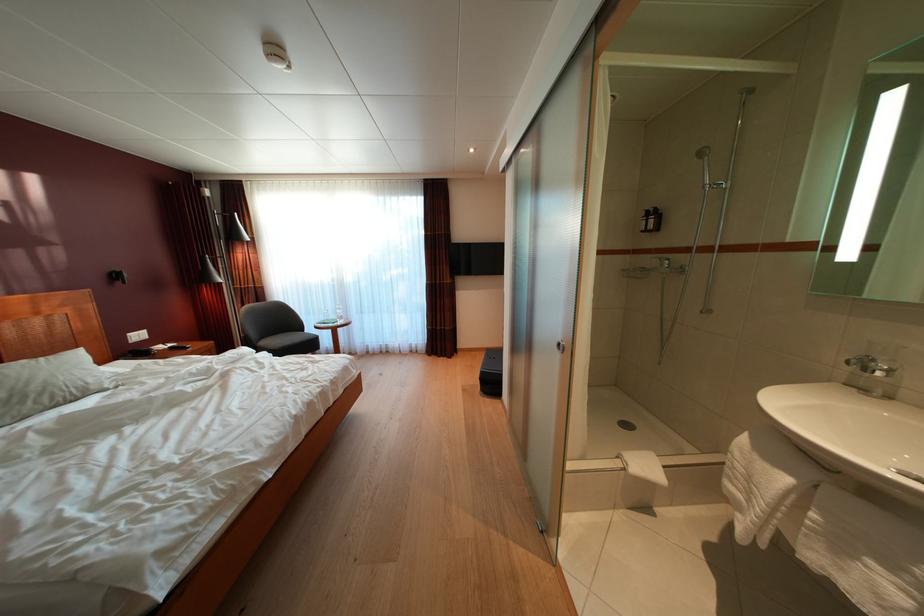
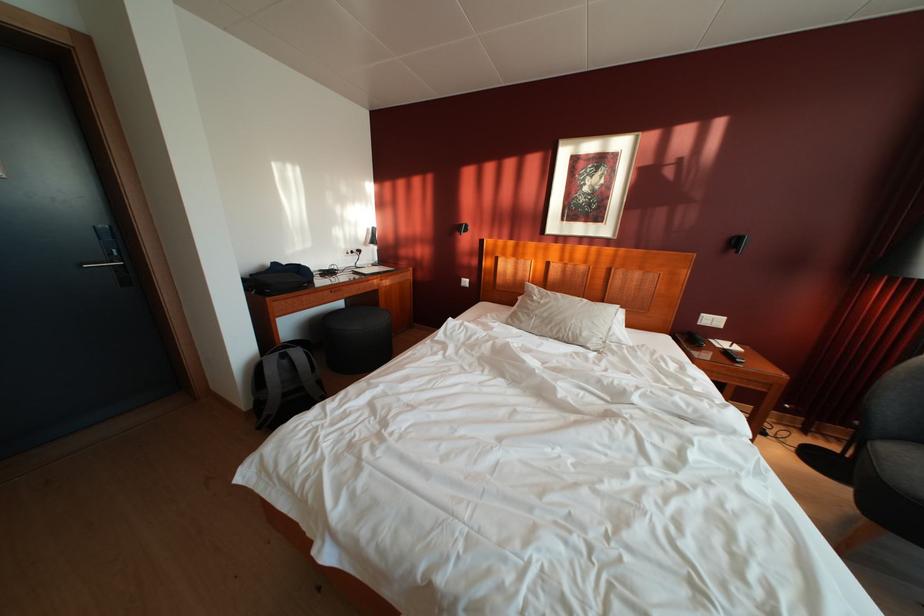
In the second image, find the point that corresponds to (x=168, y=353) in the first image.

(732, 350)